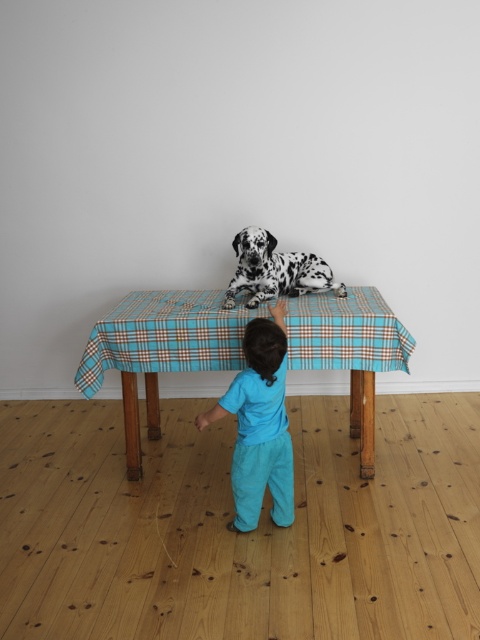
Question: Can you confirm if blue plaid tablecloth at center is positioned above turquoise cotton pants at center?

Choices:
 (A) no
 (B) yes

Answer: (B)

Question: Is turquoise cotton pants at center smaller than spotted fur dog at center?

Choices:
 (A) no
 (B) yes

Answer: (A)

Question: Estimate the real-world distances between objects in this image. Which object is closer to the spotted fur dog at center?

Choices:
 (A) blue plaid tablecloth at center
 (B) turquoise cotton pants at center

Answer: (A)

Question: Which object is farther from the camera taking this photo?

Choices:
 (A) blue plaid tablecloth at center
 (B) spotted fur dog at center

Answer: (B)

Question: Which is farther from the turquoise cotton pants at center?

Choices:
 (A) spotted fur dog at center
 (B) blue plaid tablecloth at center

Answer: (A)

Question: Can you confirm if turquoise cotton pants at center is bigger than spotted fur dog at center?

Choices:
 (A) no
 (B) yes

Answer: (B)